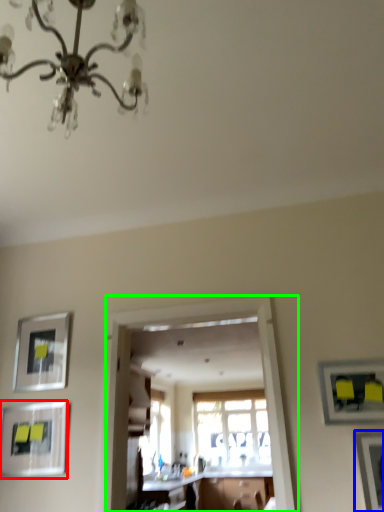
Question: Which object is positioned farthest from picture frame (highlighted by a red box)? Select from picture frame (highlighted by a blue box) and glass door (highlighted by a green box).

Choices:
 (A) picture frame
 (B) glass door

Answer: (A)